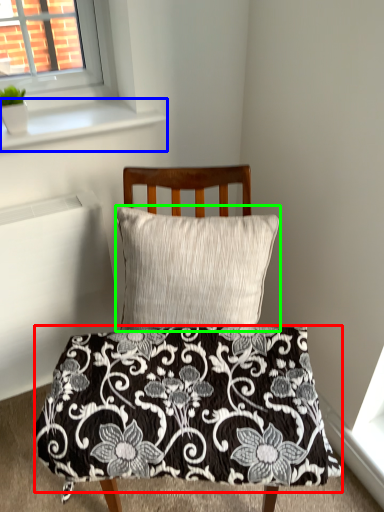
Question: Estimate the real-world distances between objects in this image. Which object is farther from blanket (highlighted by a red box), window sill (highlighted by a blue box) or pillow (highlighted by a green box)?

Choices:
 (A) window sill
 (B) pillow

Answer: (A)